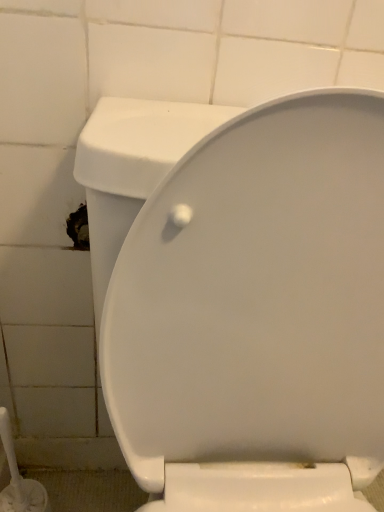
Question: Is white plastic brush at lower left wider than white glossy toilet at center?

Choices:
 (A) yes
 (B) no

Answer: (B)

Question: Is white plastic brush at lower left oriented away from white glossy toilet at center?

Choices:
 (A) yes
 (B) no

Answer: (B)

Question: Is white glossy toilet at center located within white plastic brush at lower left?

Choices:
 (A) yes
 (B) no

Answer: (B)

Question: From the image's perspective, is white plastic brush at lower left on top of white glossy toilet at center?

Choices:
 (A) no
 (B) yes

Answer: (A)

Question: Could you tell me if white plastic brush at lower left is facing white glossy toilet at center?

Choices:
 (A) yes
 (B) no

Answer: (B)

Question: Is white plastic brush at lower left positioned in front of white glossy toilet at center?

Choices:
 (A) yes
 (B) no

Answer: (B)

Question: From the image's perspective, does white glossy toilet at center appear higher than white plastic brush at lower left?

Choices:
 (A) no
 (B) yes

Answer: (B)

Question: Considering the relative sizes of white glossy toilet at center and white plastic brush at lower left in the image provided, is white glossy toilet at center thinner than white plastic brush at lower left?

Choices:
 (A) yes
 (B) no

Answer: (B)

Question: From a real-world perspective, does white glossy toilet at center stand above white plastic brush at lower left?

Choices:
 (A) yes
 (B) no

Answer: (A)

Question: Is white glossy toilet at center not within white plastic brush at lower left?

Choices:
 (A) yes
 (B) no

Answer: (A)

Question: Does white glossy toilet at center have a greater width compared to white plastic brush at lower left?

Choices:
 (A) no
 (B) yes

Answer: (B)

Question: From the image's perspective, is white glossy toilet at center located beneath white plastic brush at lower left?

Choices:
 (A) yes
 (B) no

Answer: (B)

Question: Does point (14, 493) appear closer or farther from the camera than point (153, 504)?

Choices:
 (A) farther
 (B) closer

Answer: (A)